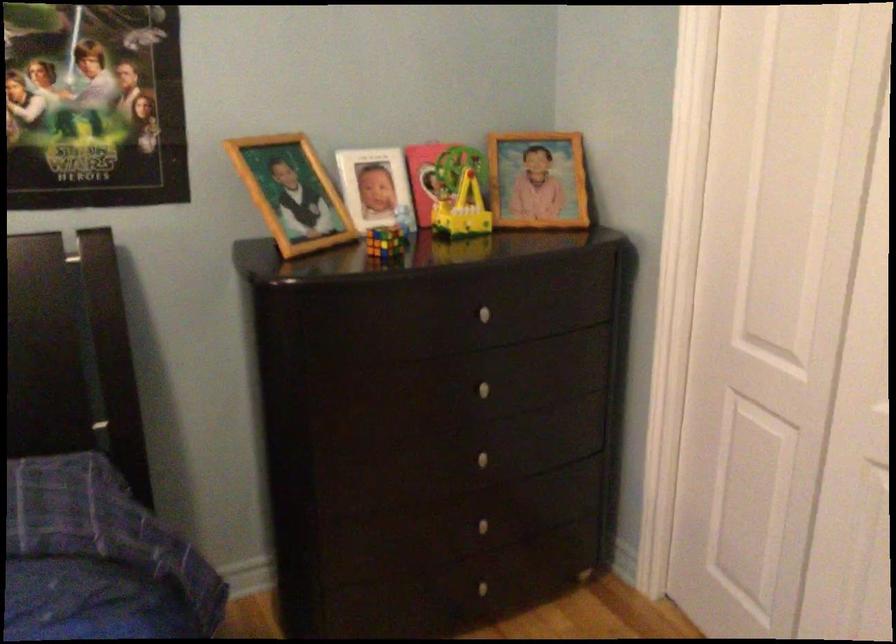
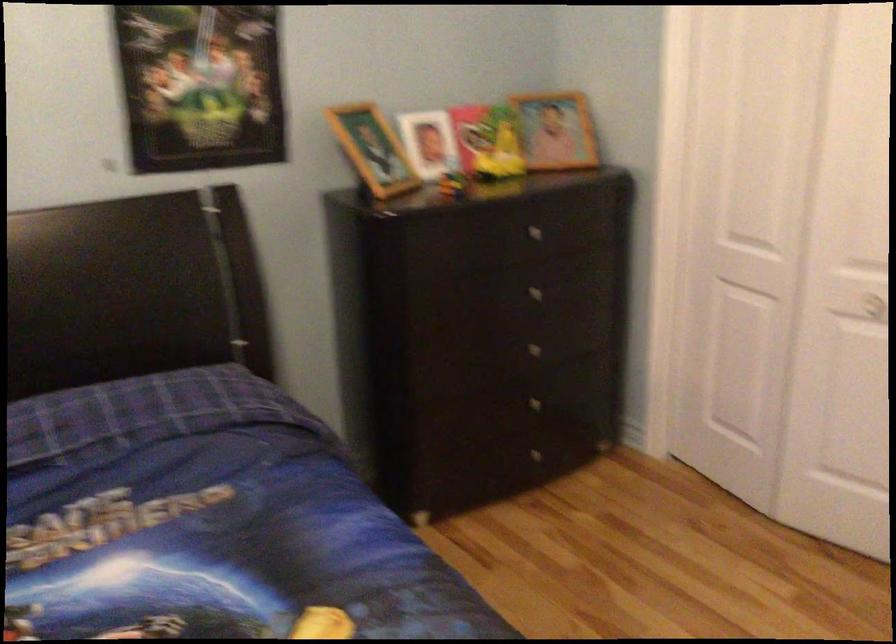
The point at (492, 462) is marked in the first image. Where is the corresponding point in the second image?

(539, 353)